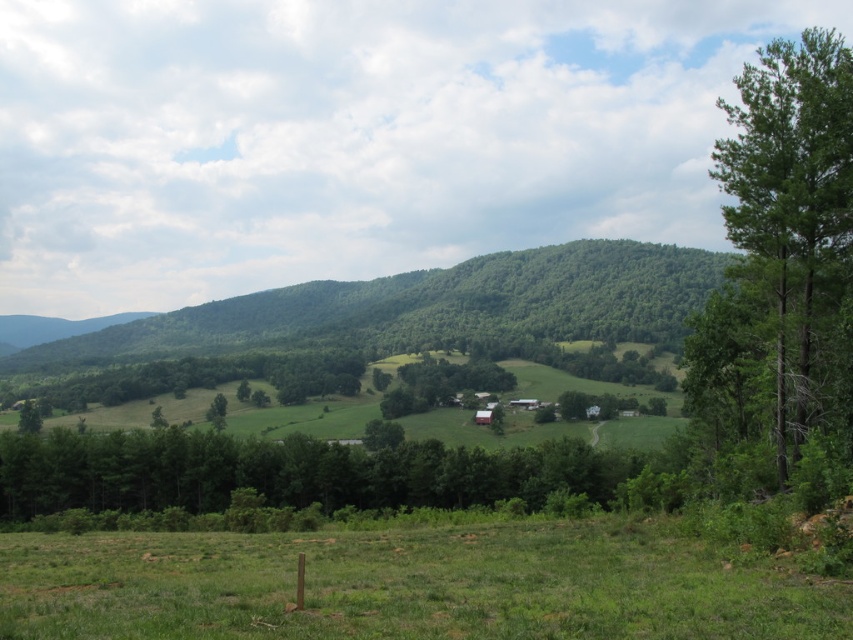
Does green leafy mountain at center have a lesser width compared to green leafy tree at center?

In fact, green leafy mountain at center might be wider than green leafy tree at center.

Is green leafy mountain at center above green leafy tree at center?

Yes, green leafy mountain at center is above green leafy tree at center.

Locate an element on the screen. green leafy mountain at center is located at coordinates (432, 307).

Between green grassy field at lower center and green leafy tree at right, which one has more height?

green leafy tree at right

Who is positioned more to the right, green grassy field at lower center or green leafy tree at right?

green leafy tree at right is more to the right.

Is point (805, 627) farther from camera compared to point (822, 397)?

That is False.

Where is `green grassy field at lower center`? green grassy field at lower center is located at coordinates (409, 586).

Does green leafy tree at center appear over green matte tree at center?

Correct, green leafy tree at center is located above green matte tree at center.

Does green leafy tree at center appear on the right side of green matte tree at center?

In fact, green leafy tree at center is to the left of green matte tree at center.

Is point (103, 468) in front of point (451, 394)?

Yes, point (103, 468) is in front of point (451, 394).

Find the location of a particular element. green leafy tree at center is located at coordinates (283, 472).